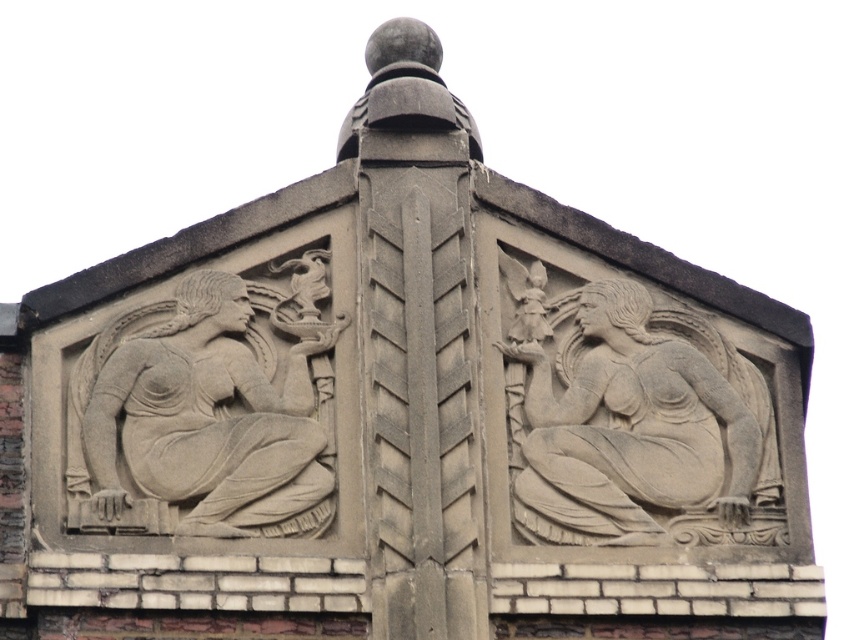
Question: Does gray stone angel at upper right have a greater width compared to gray stone sculpture at left?

Choices:
 (A) yes
 (B) no

Answer: (A)

Question: Which object appears farthest from the camera in this image?

Choices:
 (A) gray stone angel at upper right
 (B) gray stone sculpture at left

Answer: (B)

Question: Is gray stone angel at upper right wider than gray stone sculpture at left?

Choices:
 (A) yes
 (B) no

Answer: (A)

Question: Is gray stone angel at upper right thinner than gray stone sculpture at left?

Choices:
 (A) yes
 (B) no

Answer: (B)

Question: Among these points, which one is farthest from the camera?

Choices:
 (A) (623, 541)
 (B) (293, 346)

Answer: (B)